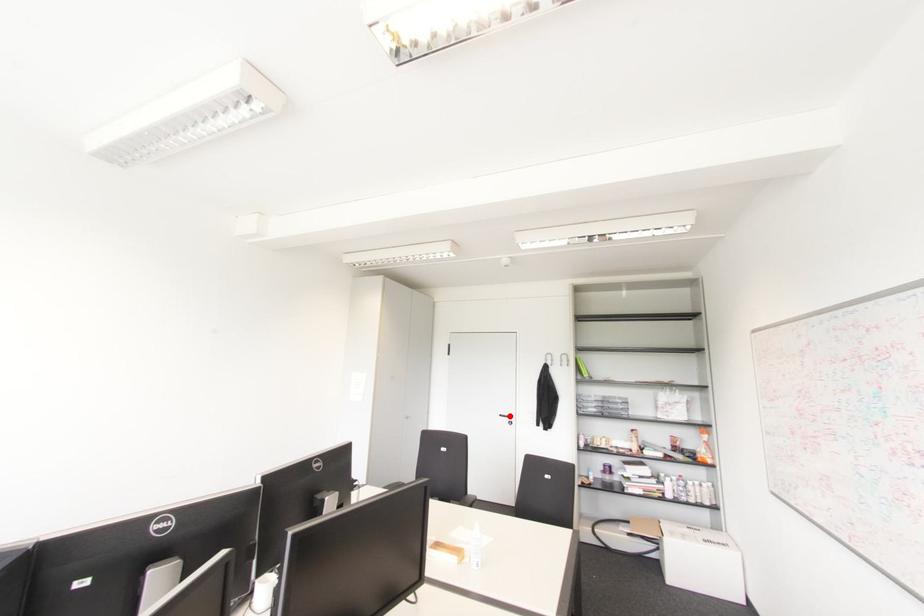
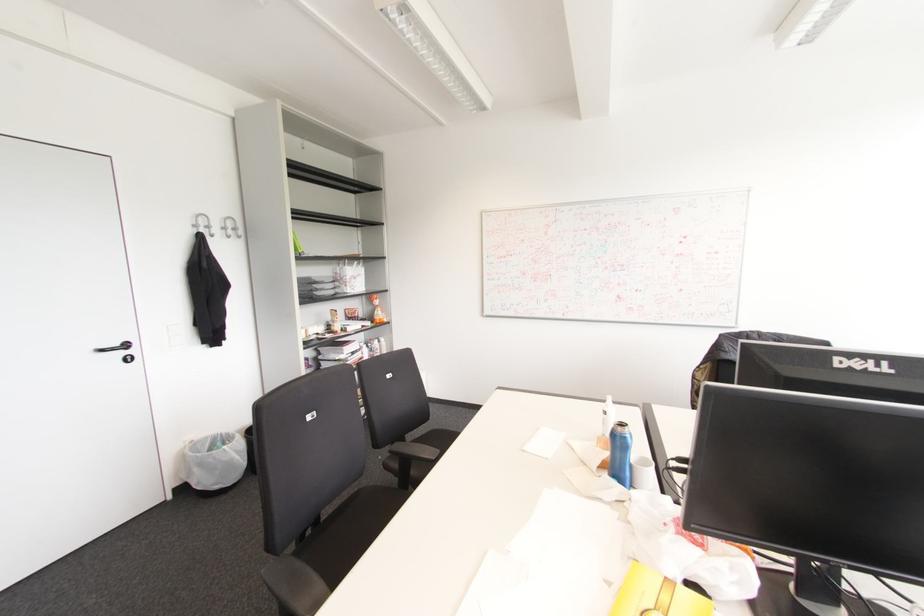
The point at the highlighted location is marked in the first image. Where is the corresponding point in the second image?

(126, 345)